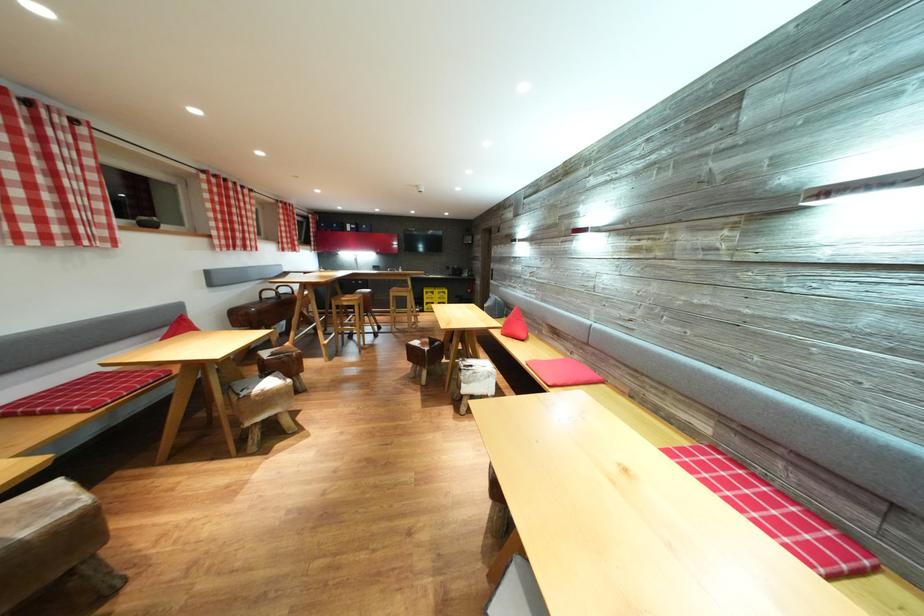
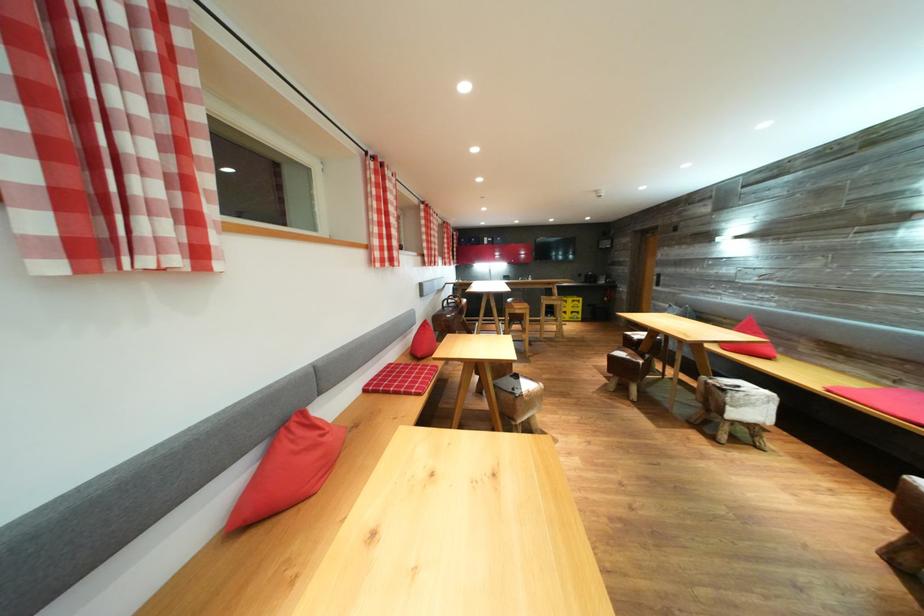
Find the pixel in the second image that matches (433,354) in the first image.

(648, 367)